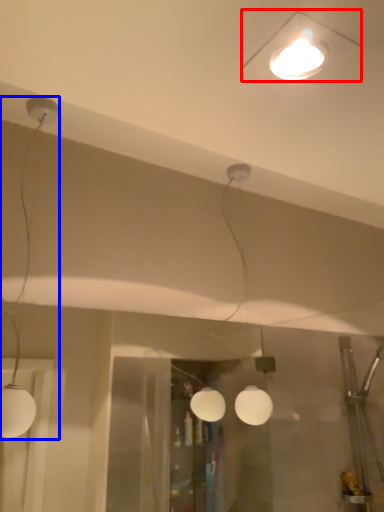
Question: Among these objects, which one is nearest to the camera, lamp (highlighted by a red box) or lamp (highlighted by a blue box)?

Choices:
 (A) lamp
 (B) lamp

Answer: (A)